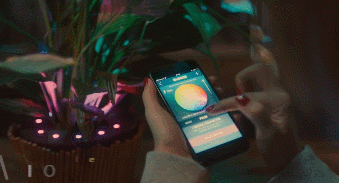
The width and height of the screenshot is (339, 183). What are the coordinates of `curtain` in the screenshot? It's located at (261, 75).